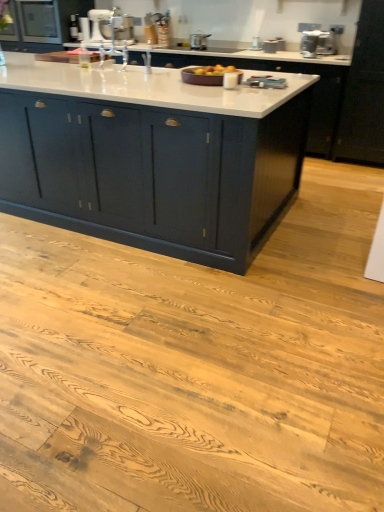
Find the location of `free spot above satin silver toaster at upper right, which ranks as the second appliance in front-to-back order (from a real-world perspective)`. free spot above satin silver toaster at upper right, which ranks as the second appliance in front-to-back order (from a real-world perspective) is located at coordinates (x=320, y=31).